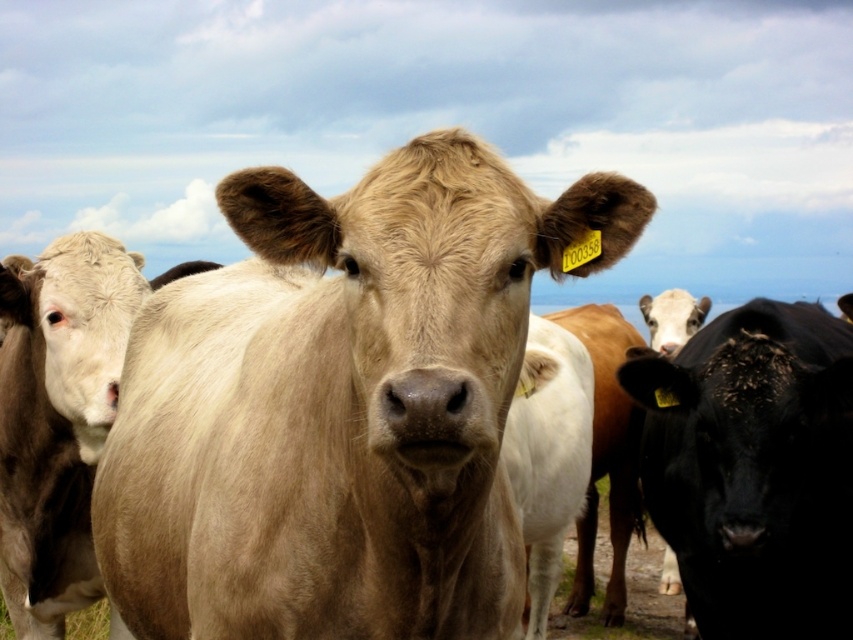
Question: Among these objects, which one is nearest to the camera?

Choices:
 (A) black glossy bull at right
 (B) smooth tan cow at center

Answer: (B)

Question: Observing the image, what is the correct spatial positioning of smooth tan cow at center in reference to black glossy bull at right?

Choices:
 (A) below
 (B) above

Answer: (B)

Question: Which point is farther to the camera?

Choices:
 (A) (817, 394)
 (B) (431, 634)

Answer: (A)

Question: Observing the image, what is the correct spatial positioning of smooth tan cow at center in reference to black glossy bull at right?

Choices:
 (A) left
 (B) right

Answer: (A)

Question: Which point is closer to the camera?

Choices:
 (A) (653, 452)
 (B) (253, 205)

Answer: (B)

Question: From the image, what is the correct spatial relationship of smooth tan cow at center in relation to black glossy bull at right?

Choices:
 (A) left
 (B) right

Answer: (A)